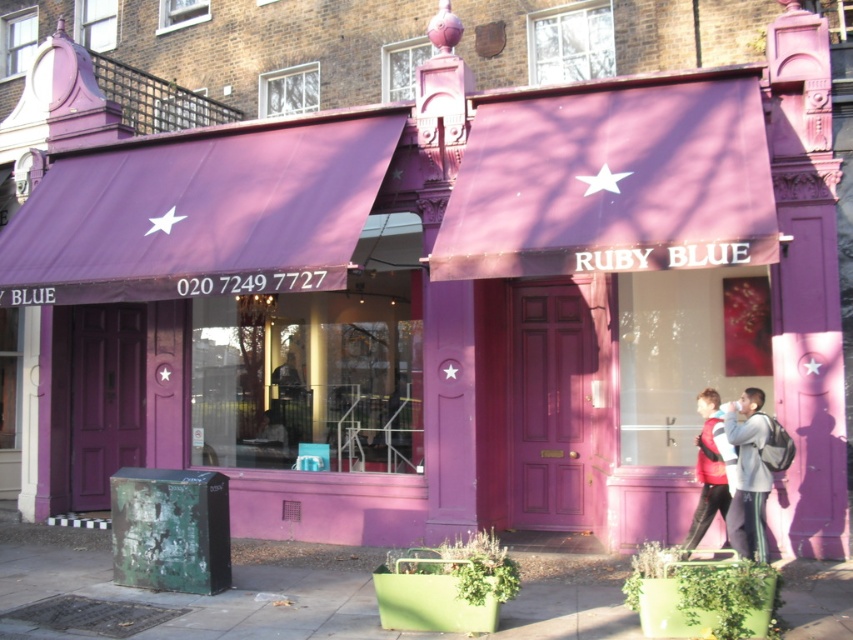
Question: Which point is farther from the camera taking this photo?

Choices:
 (A) (747, 531)
 (B) (347, 330)

Answer: (B)

Question: Does green metal planters at lower center come in front of gray fabric jacket at center?

Choices:
 (A) no
 (B) yes

Answer: (B)

Question: Does transparent glass shop window at center have a larger size compared to red leather jacket at right?

Choices:
 (A) yes
 (B) no

Answer: (B)

Question: Among these points, which one is nearest to the camera?

Choices:
 (A) click(x=264, y=448)
 (B) click(x=727, y=458)
 (C) click(x=3, y=602)
 (D) click(x=741, y=547)

Answer: (D)

Question: Is transparent glass shop window at center further to camera compared to gray fabric jacket at center?

Choices:
 (A) yes
 (B) no

Answer: (A)

Question: Which object is closer to the camera taking this photo?

Choices:
 (A) red leather jacket at right
 (B) green metal planters at lower center

Answer: (B)